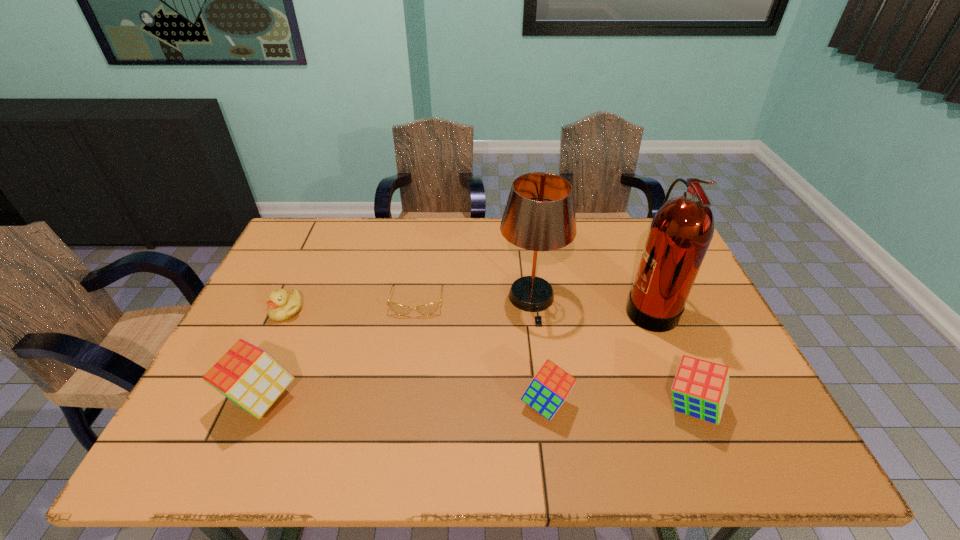
Where is `empty location between the leftmost cube and the lampshade`? This screenshot has height=540, width=960. empty location between the leftmost cube and the lampshade is located at coordinates (396, 348).

Where is `free space between the rightmost cube and the fifth tallest object`? free space between the rightmost cube and the fifth tallest object is located at coordinates (619, 405).

Image resolution: width=960 pixels, height=540 pixels. I want to click on blank region between the shortest object and the fourth tallest object, so click(x=554, y=354).

Where is `blank region between the rightmost cube and the spectacles`? The image size is (960, 540). blank region between the rightmost cube and the spectacles is located at coordinates (554, 354).

Find the location of a particular element. vacant area that lies between the fifth tallest object and the lampshade is located at coordinates (539, 351).

Locate an element on the screen. Image resolution: width=960 pixels, height=540 pixels. empty space between the second cube from right to left and the lampshade is located at coordinates (539, 351).

Find the location of a particular element. unoccupied position between the shortest cube and the sixth tallest object is located at coordinates click(417, 357).

Locate an element on the screen. vacant area that lies between the fire extinguisher and the second shortest cube is located at coordinates (670, 356).

The width and height of the screenshot is (960, 540). In order to click on vacant area between the rightmost cube and the fire extinguisher in this screenshot , I will do `click(670, 356)`.

Where is `object that stands as the fifth closest to the third object from left to right`? object that stands as the fifth closest to the third object from left to right is located at coordinates (681, 231).